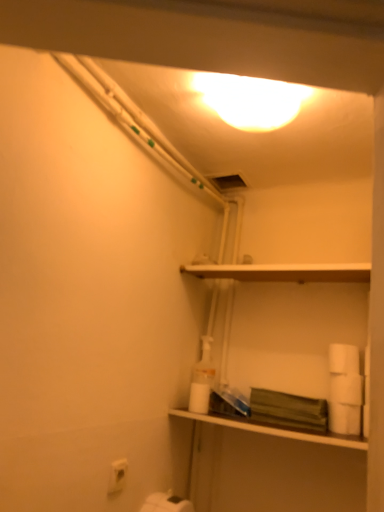
Find the location of `vacant space that is to the left of white matte toilet paper at lower right, the 3th toilet paper viewed from the right`. vacant space that is to the left of white matte toilet paper at lower right, the 3th toilet paper viewed from the right is located at coordinates (301, 430).